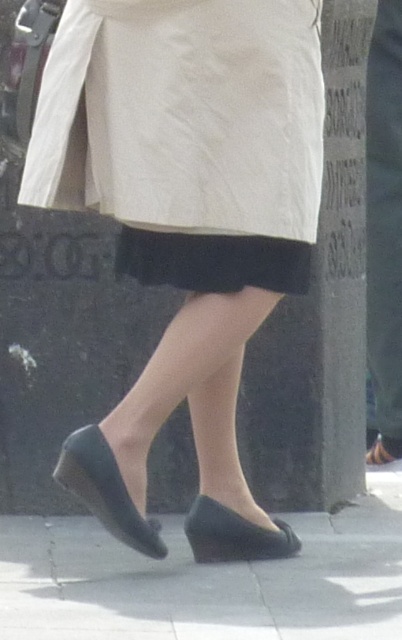
In the scene shown: Does matte black shoes at center appear under black rubber shoes at lower center?

Actually, matte black shoes at center is above black rubber shoes at lower center.

Which is in front, point (268, 307) or point (270, 604)?

Positioned in front is point (270, 604).

Which is in front, point (209, 221) or point (59, 518)?

Positioned in front is point (209, 221).

You are a GUI agent. You are given a task and a screenshot of the screen. Output one action in this format:
    pyautogui.click(x=<x>, y=<y>)
    Task: Click on the matte black shoes at center
    The height and width of the screenshot is (640, 402).
    Given the screenshot: What is the action you would take?
    pyautogui.click(x=184, y=209)

Is matte beige coat at center thinner than black matte skirt at center?

In fact, matte beige coat at center might be wider than black matte skirt at center.

Does matte beige coat at center have a greater width compared to black matte skirt at center?

Yes.

Describe the element at coordinates (182, 115) in the screenshot. The height and width of the screenshot is (640, 402). I see `matte beige coat at center` at that location.

Locate an element on the screen. The width and height of the screenshot is (402, 640). matte beige coat at center is located at coordinates (182, 115).

Which is more to the left, matte beige coat at center or matte black shoe at lower center?

Positioned to the left is matte beige coat at center.

Consider the image. Can you confirm if matte beige coat at center is positioned to the left of matte black shoe at lower center?

Indeed, matte beige coat at center is positioned on the left side of matte black shoe at lower center.

The image size is (402, 640). Describe the element at coordinates (182, 115) in the screenshot. I see `matte beige coat at center` at that location.

The width and height of the screenshot is (402, 640). In order to click on matte beige coat at center in this screenshot , I will do [x=182, y=115].